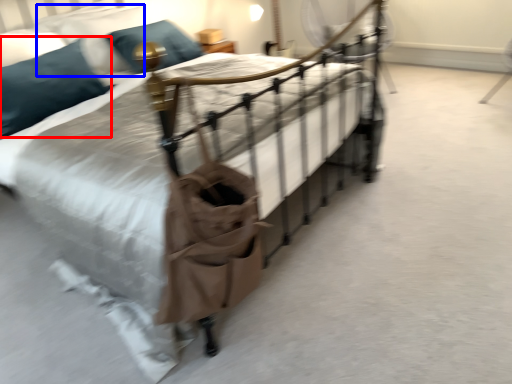
Question: Among these objects, which one is nearest to the camera, pillow (highlighted by a red box) or pillow (highlighted by a blue box)?

Choices:
 (A) pillow
 (B) pillow

Answer: (A)